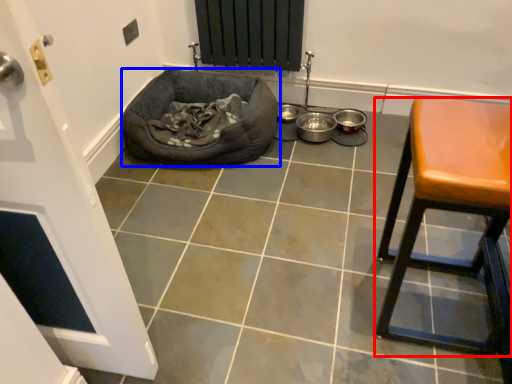
Question: Among these objects, which one is nearest to the camera, furniture (highlighted by a red box) or dog bed (highlighted by a blue box)?

Choices:
 (A) furniture
 (B) dog bed

Answer: (A)